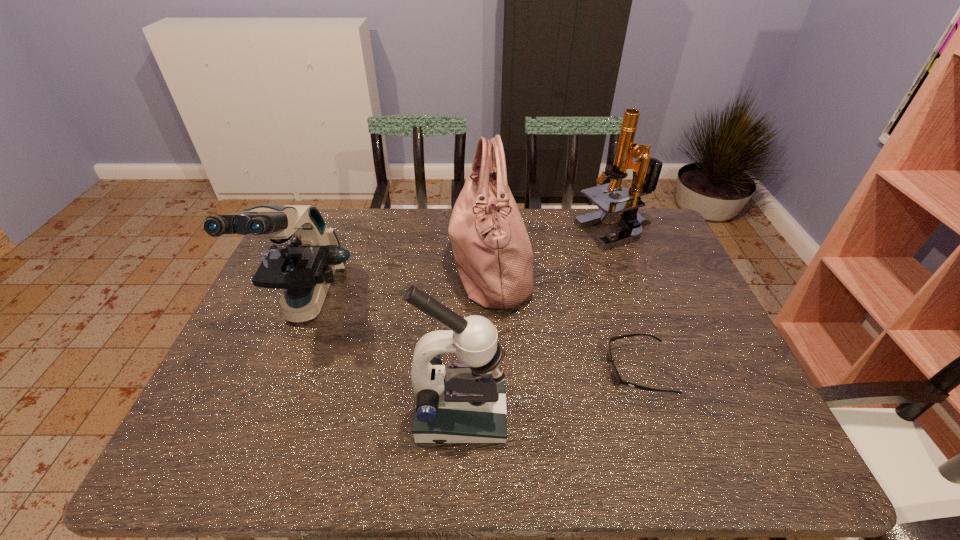
At what (x,y) coordinates should I click in order to perform the action: click on free region that satisfies the following two spatial constraints: 1. through the eyepieces of the second microscope from left to right; 2. on the right side of the second farthest microscope. Please return your answer as a coordinate pair (x, y). Looking at the image, I should click on (262, 414).

The width and height of the screenshot is (960, 540). In order to click on free space that satisfies the following two spatial constraints: 1. at the front of the handbag with handles; 2. through the eyepieces of the leftmost object in this screenshot , I will do `click(492, 303)`.

Where is `free spot that satisfies the following two spatial constraints: 1. on the front-facing side of the shortest object; 2. on the front side of the second microscope from left to right`? This screenshot has height=540, width=960. free spot that satisfies the following two spatial constraints: 1. on the front-facing side of the shortest object; 2. on the front side of the second microscope from left to right is located at coordinates (654, 414).

The height and width of the screenshot is (540, 960). Find the location of `vacant area in the image that satisfies the following two spatial constraints: 1. at the eyepiece of the rightmost microscope; 2. on the front side of the nearest microscope`. vacant area in the image that satisfies the following two spatial constraints: 1. at the eyepiece of the rightmost microscope; 2. on the front side of the nearest microscope is located at coordinates (685, 414).